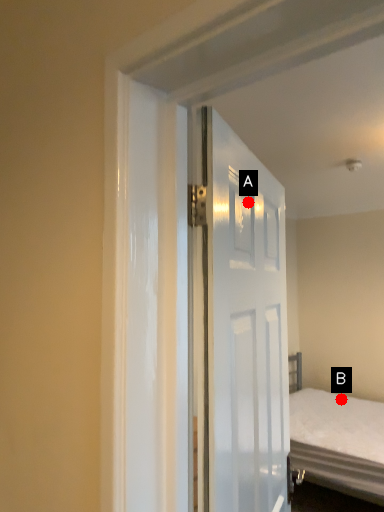
Question: Two points are circled on the image, labeled by A and B beside each circle. Which point is closer to the camera taking this photo?

Choices:
 (A) A is closer
 (B) B is closer

Answer: (A)